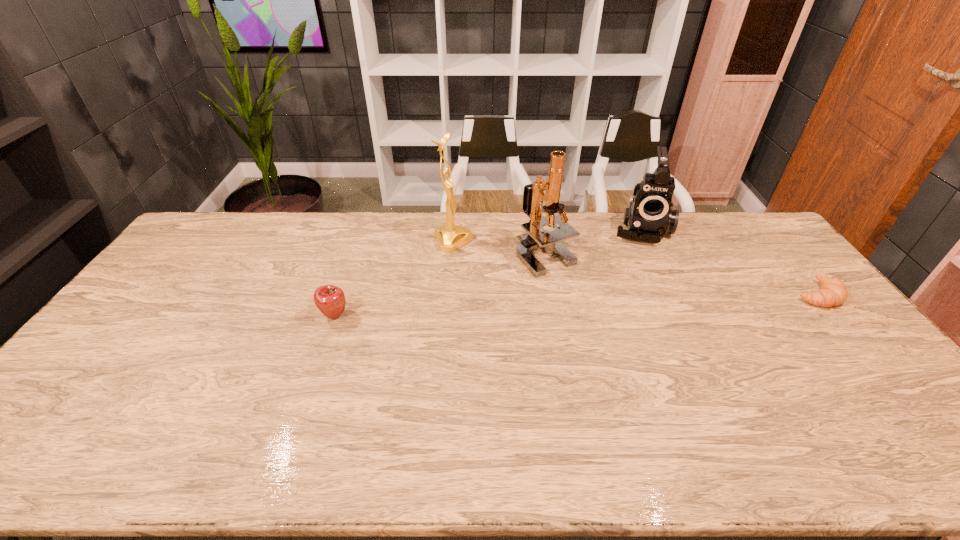
Where is `free space on the desktop that is between the apple and the shortest object and is positioned at the eyepiece of the microscope`? The height and width of the screenshot is (540, 960). free space on the desktop that is between the apple and the shortest object and is positioned at the eyepiece of the microscope is located at coordinates (559, 306).

Image resolution: width=960 pixels, height=540 pixels. Identify the location of free space on the desktop that is between the second shortest object and the crescent roll and is positioned on the front-facing side of the second object from left to right. (582, 305).

You are a GUI agent. You are given a task and a screenshot of the screen. Output one action in this format:
    pyautogui.click(x=<x>, y=<y>)
    Task: Click on the vacant space on the desktop that is between the leftmost object and the shortest object and is positioned on the lens mount of the camcorder
    
    Given the screenshot: What is the action you would take?
    pyautogui.click(x=643, y=302)